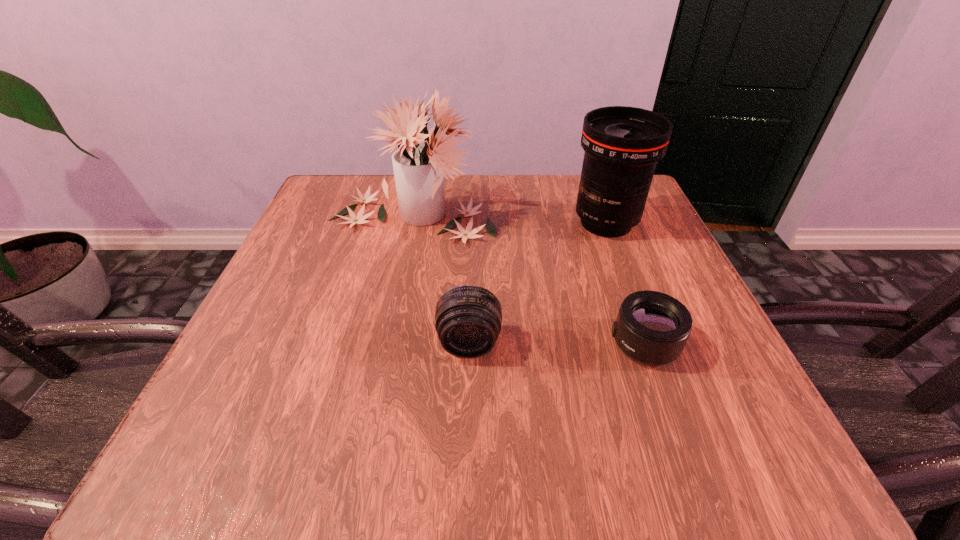
The height and width of the screenshot is (540, 960). I want to click on the tallest object, so click(x=418, y=169).

In order to click on the third shortest object in this screenshot , I will do `click(622, 144)`.

Identify the location of the tallest telephoto lens. (622, 144).

This screenshot has height=540, width=960. What are the coordinates of `the leftmost telephoto lens` in the screenshot? It's located at (468, 318).

Where is `the second tallest telephoto lens`? the second tallest telephoto lens is located at coordinates (468, 318).

The image size is (960, 540). I want to click on the shortest telephoto lens, so click(x=652, y=328).

Where is `free location located 0.110m on the right of the bouquet`? free location located 0.110m on the right of the bouquet is located at coordinates (545, 216).

The width and height of the screenshot is (960, 540). I want to click on free spot located on the left of the third shortest object, so click(398, 223).

You are a GUI agent. You are given a task and a screenshot of the screen. Output one action in this format:
    pyautogui.click(x=<x>, y=<y>)
    Task: Click on the blank space located 0.070m at the front element of the leftmost telephoto lens
    Image resolution: width=960 pixels, height=540 pixels.
    Given the screenshot: What is the action you would take?
    pyautogui.click(x=468, y=403)

This screenshot has width=960, height=540. I want to click on vacant space located on the side of the shortest object with brand markings and control switches, so click(566, 344).